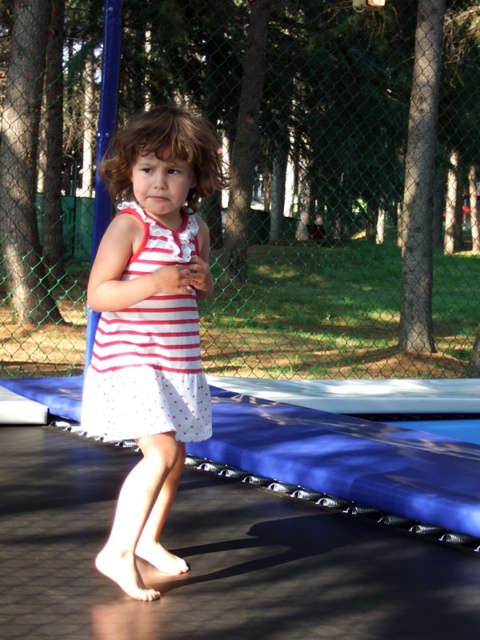
Can you confirm if white polka dot dress at center is bigger than white dotted dress at center?

Yes.

Which of these two, white polka dot dress at center or white dotted dress at center, stands shorter?

Standing shorter between the two is white dotted dress at center.

What do you see at coordinates (151, 326) in the screenshot? Image resolution: width=480 pixels, height=640 pixels. I see `white polka dot dress at center` at bounding box center [151, 326].

You are a GUI agent. You are given a task and a screenshot of the screen. Output one action in this format:
    pyautogui.click(x=<x>, y=<y>)
    Task: Click on the white polka dot dress at center
    
    Given the screenshot: What is the action you would take?
    pyautogui.click(x=151, y=326)